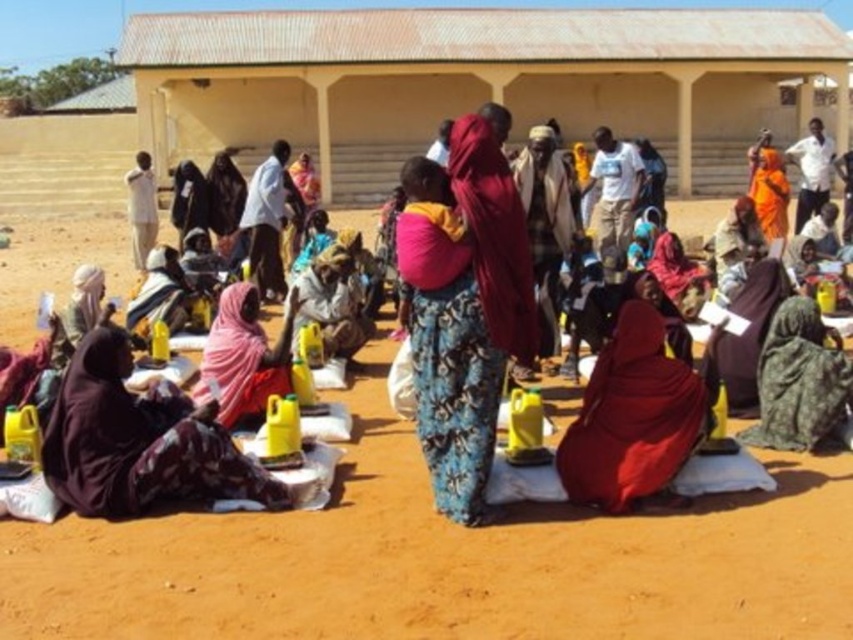
This screenshot has width=853, height=640. Describe the element at coordinates (138, 442) in the screenshot. I see `dark purple fabric at lower left` at that location.

Can you confirm if dark purple fabric at lower left is positioned below camouflage fabric headscarf at lower right?

Yes, dark purple fabric at lower left is below camouflage fabric headscarf at lower right.

Is point (212, 499) farther from viewer compared to point (776, 410)?

That is False.

Image resolution: width=853 pixels, height=640 pixels. I want to click on dark purple fabric at lower left, so click(138, 442).

In the scene shown: Between matte red cloth at center and camouflage fabric headscarf at lower right, which one has less height?

camouflage fabric headscarf at lower right

Does point (641, 476) lie behind point (801, 380)?

No.

Identify the location of matte red cloth at center. (636, 417).

Is pink fabric headscarf at lower left shorter than matte black turban at left?

In fact, pink fabric headscarf at lower left may be taller than matte black turban at left.

Between pink fabric headscarf at lower left and matte black turban at left, which one is positioned lower?

pink fabric headscarf at lower left

This screenshot has height=640, width=853. I want to click on pink fabric headscarf at lower left, so click(x=242, y=356).

Locate an element on the screen. This screenshot has width=853, height=640. pink fabric headscarf at lower left is located at coordinates (242, 356).